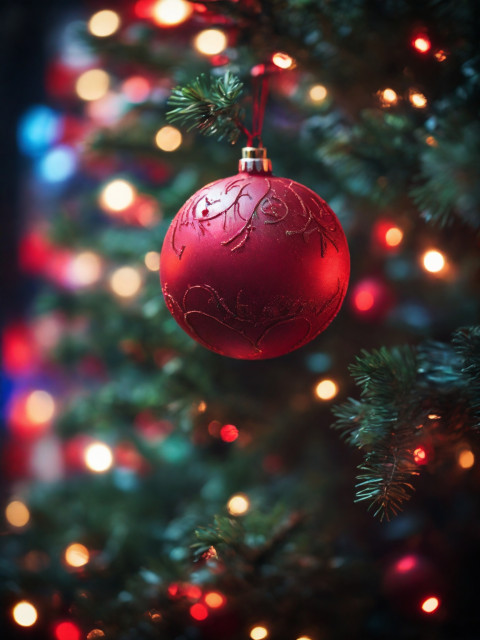
Where is `white top of ornament`? white top of ornament is located at coordinates (255, 159).